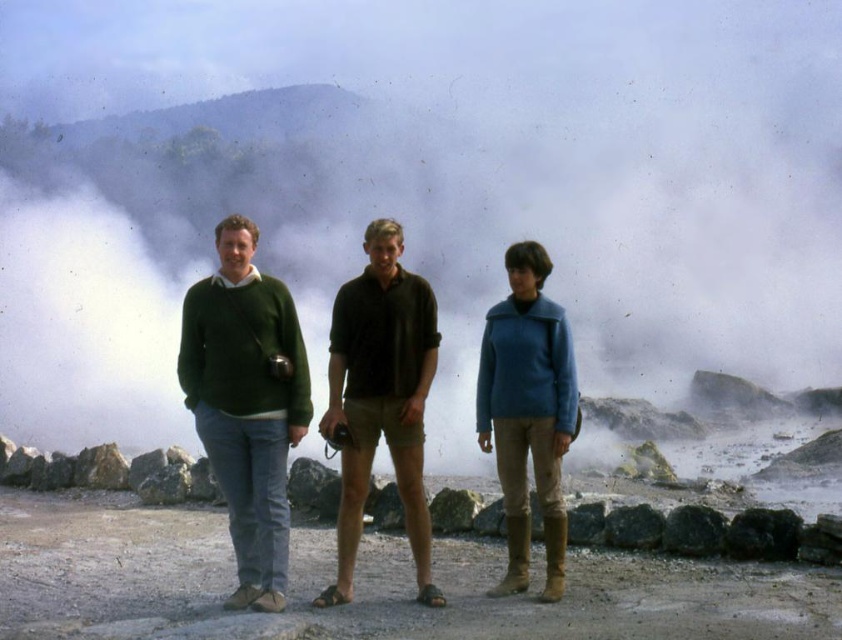
Describe the element at coordinates (419, 188) in the screenshot. I see `white smoke at center` at that location.

Does white smoke at center have a greater width compared to green wool sweater at center?

Correct, the width of white smoke at center exceeds that of green wool sweater at center.

Who is more distant from viewer, (493, 241) or (339, 513)?

The point (493, 241) is more distant.

Identify the location of white smoke at center. Image resolution: width=842 pixels, height=640 pixels. 419,188.

Is white smoke at center below dark green polo shirt at center?

Actually, white smoke at center is above dark green polo shirt at center.

Between white smoke at center and dark green polo shirt at center, which one appears on the left side from the viewer's perspective?

white smoke at center

Does point (441, 442) come closer to viewer compared to point (421, 449)?

No, (441, 442) is behind (421, 449).

The width and height of the screenshot is (842, 640). I want to click on white smoke at center, so click(419, 188).

Between green sweater at left and blue woolen sweater at center, which one appears on the left side from the viewer's perspective?

green sweater at left

The height and width of the screenshot is (640, 842). In order to click on green sweater at left in this screenshot , I will do `click(246, 403)`.

Between point (195, 333) and point (517, 561), which one is positioned in front?

Point (517, 561)

Where is `green sweater at left`? Image resolution: width=842 pixels, height=640 pixels. green sweater at left is located at coordinates (246, 403).